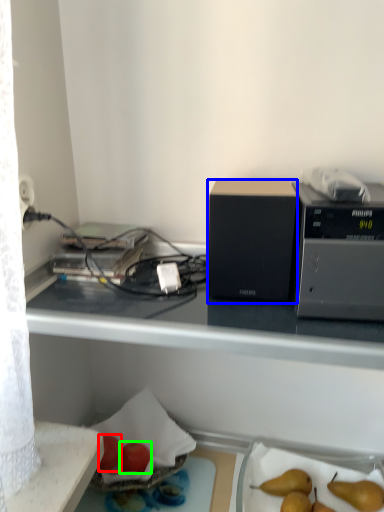
Question: Which object is the closest to the apple (highlighted by a red box)? Choose among these: appliance (highlighted by a blue box) or apple (highlighted by a green box).

Choices:
 (A) appliance
 (B) apple

Answer: (B)